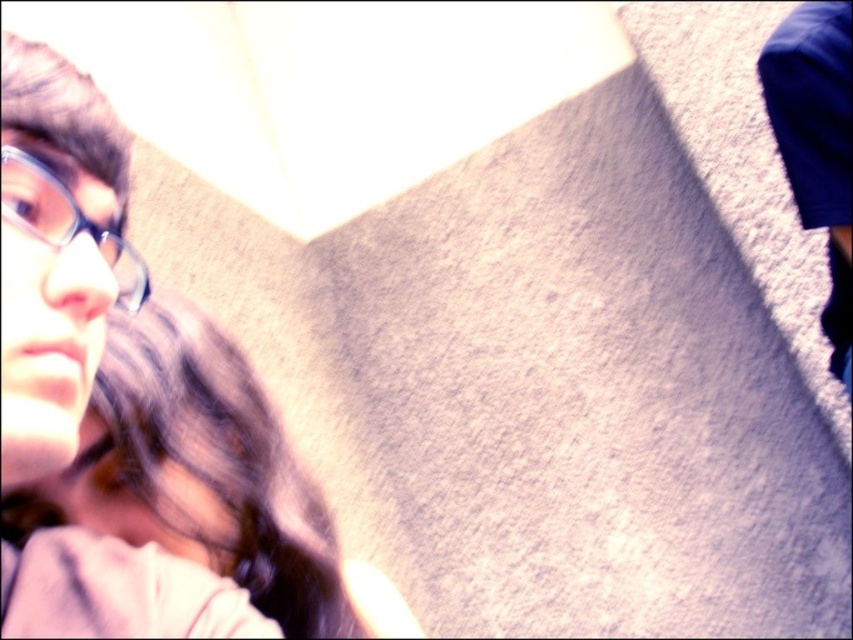
Question: Considering the relative positions of smooth skin face at left and matte black glasses at left in the image provided, where is smooth skin face at left located with respect to matte black glasses at left?

Choices:
 (A) below
 (B) above

Answer: (A)

Question: Which of the following is the closest to the observer?

Choices:
 (A) 100,368
 (B) 28,205

Answer: (B)

Question: Which point is farther to the camera?

Choices:
 (A) smooth skin face at left
 (B) matte black glasses at left

Answer: (A)

Question: Does smooth skin face at left appear over matte black glasses at left?

Choices:
 (A) yes
 (B) no

Answer: (B)

Question: Which object appears closest to the camera in this image?

Choices:
 (A) smooth skin face at left
 (B) matte black glasses at left

Answer: (B)

Question: Does smooth skin face at left have a greater width compared to matte black glasses at left?

Choices:
 (A) no
 (B) yes

Answer: (B)